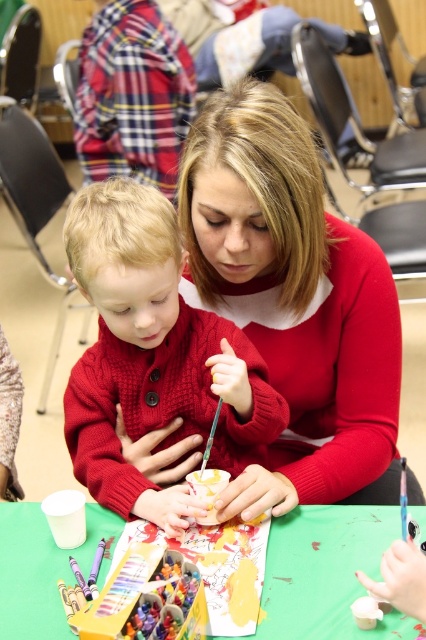
Question: Is cable-knit sweater at center positioned behind green paper at center?

Choices:
 (A) yes
 (B) no

Answer: (A)

Question: In this image, where is matte red sweater at center located relative to cable-knit sweater at center?

Choices:
 (A) right
 (B) left

Answer: (A)

Question: Which of these objects is positioned closest to the matte red sweater at center?

Choices:
 (A) cable-knit sweater at center
 (B) green paper at center

Answer: (A)

Question: Among these objects, which one is farthest from the camera?

Choices:
 (A) cable-knit sweater at center
 (B) green paper at center

Answer: (A)

Question: Does matte red sweater at center have a lesser width compared to cable-knit sweater at center?

Choices:
 (A) no
 (B) yes

Answer: (A)

Question: Considering the real-world distances, which object is closest to the matte red sweater at center?

Choices:
 (A) green paper at center
 (B) cable-knit sweater at center

Answer: (B)